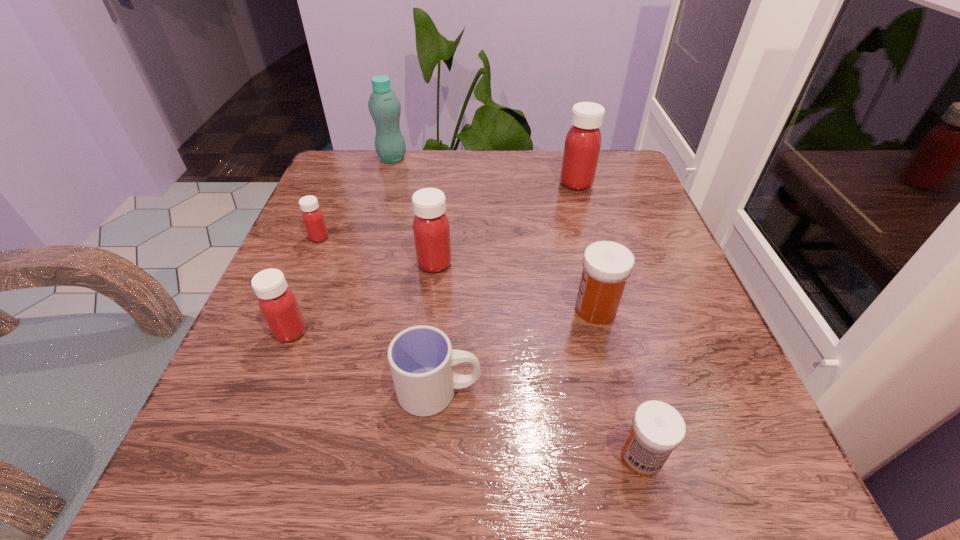
Locate an element on the screen. the fifth nearest medicine is located at coordinates (312, 216).

Locate an element on the screen. Image resolution: width=960 pixels, height=540 pixels. the nearest medicine is located at coordinates (657, 429).

Identify the location of the nearest object. The width and height of the screenshot is (960, 540). (657, 429).

I want to click on vacant region located at the front cap of the water bottle, so click(x=451, y=159).

Where is `vacant space located 0.080m on the left of the farthest medicine`? This screenshot has width=960, height=540. vacant space located 0.080m on the left of the farthest medicine is located at coordinates (525, 183).

Where is `vacant space located 0.270m on the back of the second nearest red medicine`? The image size is (960, 540). vacant space located 0.270m on the back of the second nearest red medicine is located at coordinates (444, 178).

I want to click on vacant area located 0.340m on the left of the farther white medicine, so click(373, 309).

This screenshot has height=540, width=960. Find the location of `vacant area located 0.250m on the right of the nearest red medicine`. vacant area located 0.250m on the right of the nearest red medicine is located at coordinates (462, 332).

Where is `free space located 0.270m with the handle on the side of the cup`? Image resolution: width=960 pixels, height=540 pixels. free space located 0.270m with the handle on the side of the cup is located at coordinates (667, 391).

Identify the location of free space located 0.390m on the right of the second farthest red medicine. The width and height of the screenshot is (960, 540). (523, 238).